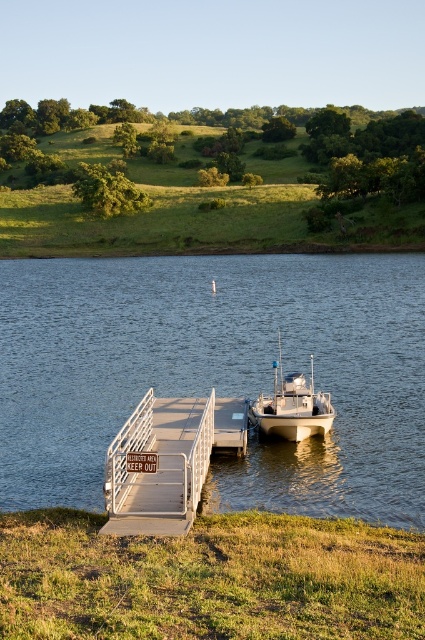
You are planning to take a photo of the clear water at dock right and the green grassy hillside at upper center. Which object should you focus on first if you want to capture both in a single frame without moving the camera?

The clear water at dock right should be focused on first because it is smaller in size compared to the green grassy hillside at upper center, allowing you to frame both objects effectively in the shot.

You are planning to launch a small kayak from the lakeside. The kayak requires a minimum of 3 meters of clear water space to maneuver safely. Given the clear water at dock right and the green grassy hillside at upper center, which area would be suitable for launching the kayak?

The clear water at dock right has a lesser width compared to the green grassy hillside at upper center. Since the kayak requires at least 3 meters of space, the green grassy hillside at upper center is wider and more suitable for launching the kayak safely.

You are standing on the dock and want to walk towards the green grassy hillside at upper center. Which direction should you go relative to the white matte boat at center?

You should walk towards the green grassy hillside at upper center, which is behind the white matte boat at center since the hillside is closer to the viewer than the boat.